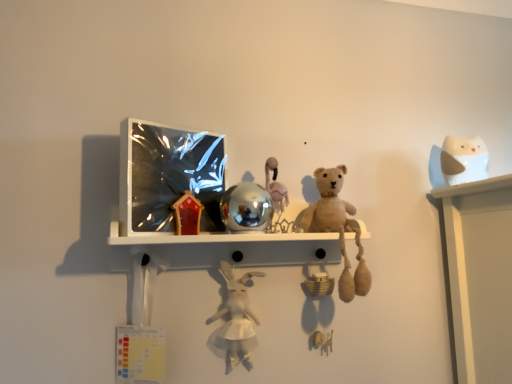
Question: Does shiny metallic ball at center, which is counted as the third toy, starting from the right, appear on the right side of white matte owl at upper right, which appears as the 4th toy when viewed from the left?

Choices:
 (A) no
 (B) yes

Answer: (A)

Question: Can you confirm if shiny metallic ball at center, which is counted as the second toy, starting from the left, is smaller than white matte owl at upper right, which appears as the 4th toy when viewed from the left?

Choices:
 (A) no
 (B) yes

Answer: (A)

Question: Would you say shiny metallic ball at center, which is counted as the second toy, starting from the left, is outside white matte owl at upper right, which appears as the 4th toy when viewed from the left?

Choices:
 (A) yes
 (B) no

Answer: (A)

Question: Considering the relative positions of shiny metallic ball at center, which is counted as the second toy, starting from the left, and white matte owl at upper right, which appears as the 4th toy when viewed from the left, in the image provided, is shiny metallic ball at center, which is counted as the second toy, starting from the left, behind white matte owl at upper right, which appears as the 4th toy when viewed from the left,?

Choices:
 (A) no
 (B) yes

Answer: (A)

Question: Can you confirm if shiny metallic ball at center, which is counted as the third toy, starting from the right, is thinner than white matte owl at upper right, which appears as the 4th toy when viewed from the left?

Choices:
 (A) yes
 (B) no

Answer: (B)

Question: Based on their positions, is metallic reflective shelf at center located to the left or right of fuzzy beige teddy bear at center, marked as the second toy in a right-to-left arrangement?

Choices:
 (A) left
 (B) right

Answer: (A)

Question: Looking at the image, does metallic reflective shelf at center seem bigger or smaller compared to fuzzy beige teddy bear at center, marked as the second toy in a right-to-left arrangement?

Choices:
 (A) small
 (B) big

Answer: (A)

Question: Is metallic reflective shelf at center taller or shorter than fuzzy beige teddy bear at center, the third toy when ordered from left to right?

Choices:
 (A) short
 (B) tall

Answer: (A)

Question: From a real-world perspective, is metallic reflective shelf at center positioned above or below fuzzy beige teddy bear at center, marked as the second toy in a right-to-left arrangement?

Choices:
 (A) below
 (B) above

Answer: (A)

Question: Is point (221, 198) positioned closer to the camera than point (163, 233)?

Choices:
 (A) farther
 (B) closer

Answer: (A)

Question: In terms of width, does shiny metallic ball at center, which is counted as the second toy, starting from the left, look wider or thinner when compared to metallic reflective shelf at center?

Choices:
 (A) thin
 (B) wide

Answer: (A)

Question: Is shiny metallic ball at center, which is counted as the second toy, starting from the left, taller or shorter than metallic reflective shelf at center?

Choices:
 (A) short
 (B) tall

Answer: (B)

Question: From a real-world perspective, is shiny metallic ball at center, which is counted as the third toy, starting from the right, above or below metallic reflective shelf at center?

Choices:
 (A) below
 (B) above

Answer: (B)

Question: Is shiny metallic ball at center, which is counted as the second toy, starting from the left, taller or shorter than white matte owl at upper right, which appears as the 4th toy when viewed from the left?

Choices:
 (A) short
 (B) tall

Answer: (A)

Question: From the image's perspective, relative to white matte owl at upper right, positioned as the 1th toy in right-to-left order, is shiny metallic ball at center, which is counted as the third toy, starting from the right, above or below?

Choices:
 (A) below
 (B) above

Answer: (A)